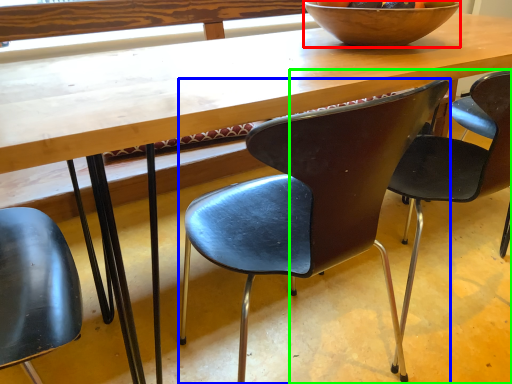
Question: Considering the real-world distances, which object is closest to bowl (highlighted by a red box)? chair (highlighted by a blue box) or chair (highlighted by a green box).

Choices:
 (A) chair
 (B) chair

Answer: (B)